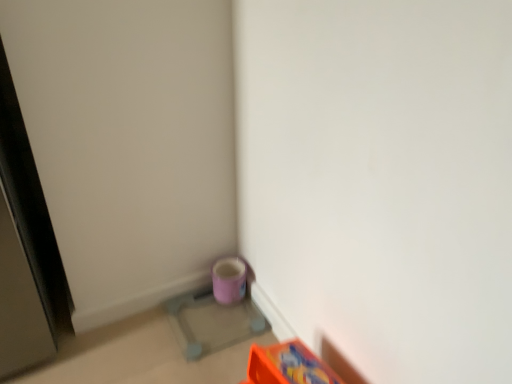
Measure the distance between pink matte cup at lower left and camera.

The distance of pink matte cup at lower left from camera is 4.22 feet.

Describe the element at coordinates (217, 311) in the screenshot. The width and height of the screenshot is (512, 384). I see `pink matte cup at lower left` at that location.

Where is `pink matte cup at lower left`? pink matte cup at lower left is located at coordinates (217, 311).

Locate an element on the screen. pink matte cup at lower left is located at coordinates (217, 311).